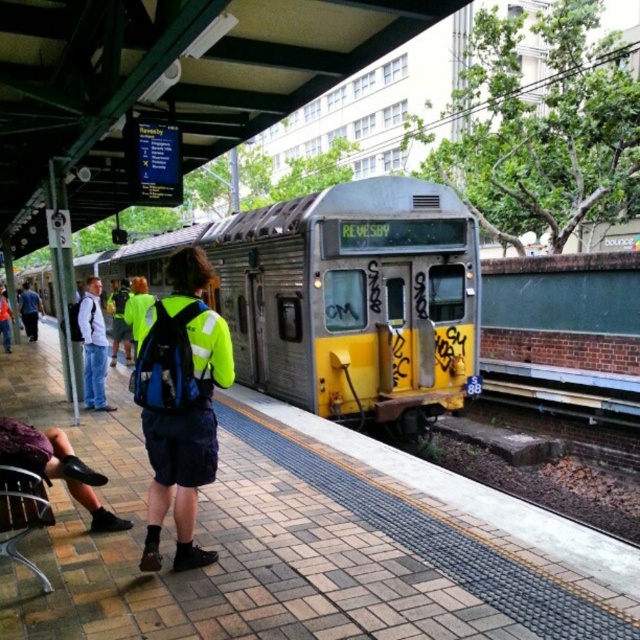
Does yellow metallic train at center have a greater height compared to light blue jeans at left?

Yes, yellow metallic train at center is taller than light blue jeans at left.

Which is in front, point (362, 232) or point (99, 397)?

Positioned in front is point (99, 397).

Which is behind, point (362, 368) or point (93, 292)?

The point (362, 368) is more distant.

What are the coordinates of `yellow metallic train at center` in the screenshot? It's located at (340, 296).